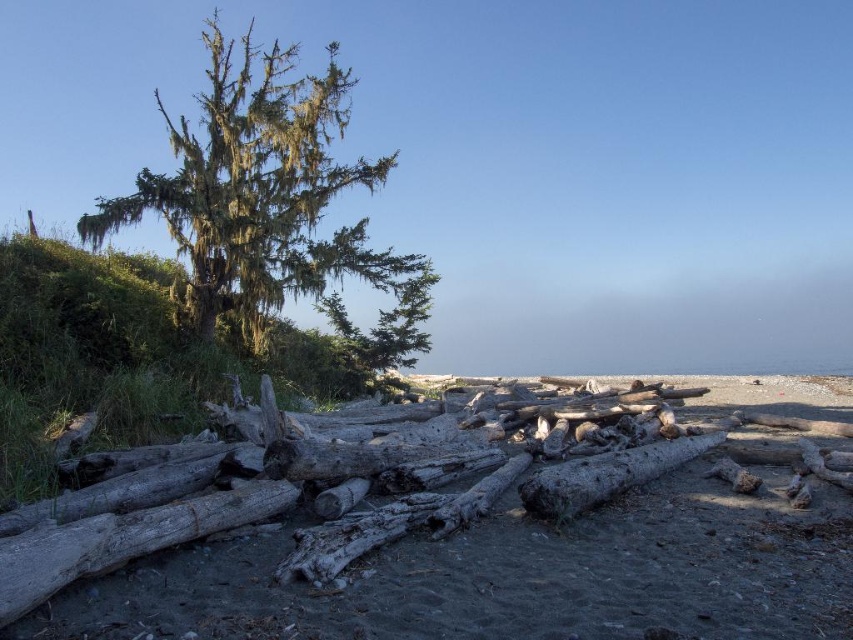
You are a photographer setting up a tripod at the center of the beach. You want to capture both the weathered wood logs at center and the green mossy tree at upper left in your shot. What is the minimum distance your camera lens needs to cover to include both subjects in the frame?

The weathered wood logs at center and the green mossy tree at upper left are 6.20 meters apart from each other. Therefore, the camera lens needs to cover at least 6.20 meters to include both subjects in the frame.

You are standing at the point labeled point (419, 544) in the image. What object are you standing on?

You are standing on the weathered wood logs at center.

You are a photographer standing at the edge of the beach in this coastal scene. You want to take a photo that includes both the tall, slender tree with Spanish moss and the driftwood in the foreground. Which of the two points, point (387,561) or point (412,317), should you focus on to ensure both the tree and driftwood are in sharp focus?

You should focus on point (387,561) because it is closer to the camera than point (412,317). By focusing on the closer point, the depth of field will extend further back, increasing the likelihood that both the tree and the driftwood are in focus.